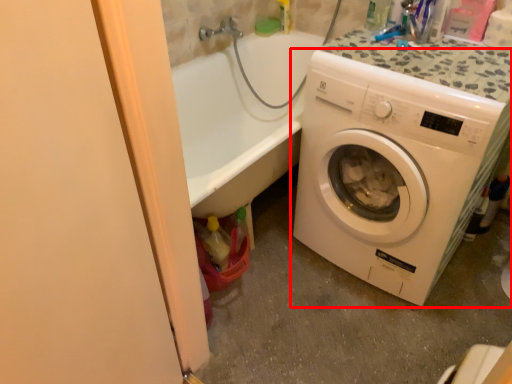
Question: From the image, what is the correct spatial relationship of washing machine (annotated by the red box) in relation to screen door?

Choices:
 (A) right
 (B) left

Answer: (A)